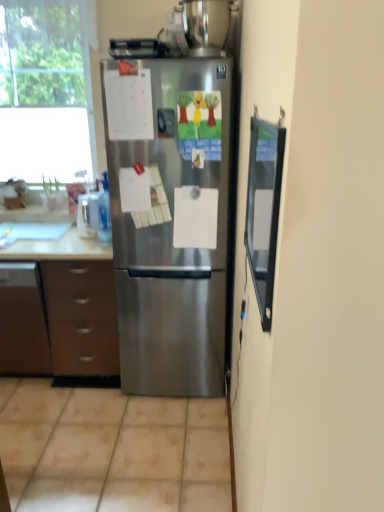
This screenshot has height=512, width=384. Find the location of `free spot above brown matte cabinet at lower left (from a real-world perspective)`. free spot above brown matte cabinet at lower left (from a real-world perspective) is located at coordinates (23, 240).